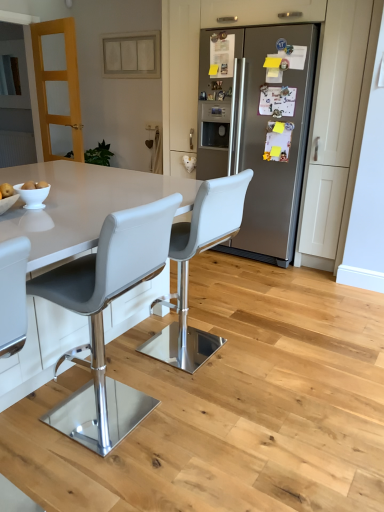
Image resolution: width=384 pixels, height=512 pixels. I want to click on free space in front of white leather stool at center, arranged as the first chair when viewed from the front, so click(102, 477).